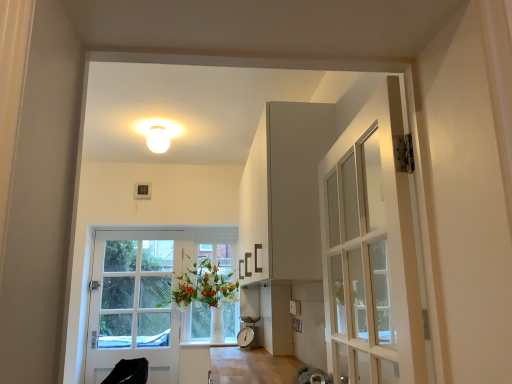
Question: Is white glossy vase at center positioned with its back to white glass vase at center?

Choices:
 (A) no
 (B) yes

Answer: (B)

Question: Would you say white glossy vase at center is a long distance from white glass vase at center?

Choices:
 (A) no
 (B) yes

Answer: (A)

Question: Can you confirm if white glossy vase at center is taller than white glass vase at center?

Choices:
 (A) yes
 (B) no

Answer: (B)

Question: Does white glossy vase at center contain white glass vase at center?

Choices:
 (A) yes
 (B) no

Answer: (B)

Question: Could you tell me if white glossy vase at center is facing white glass vase at center?

Choices:
 (A) yes
 (B) no

Answer: (A)

Question: From a real-world perspective, is white glossy vase at center physically located above or below white glass vase at center?

Choices:
 (A) below
 (B) above

Answer: (A)

Question: In terms of width, does white glossy vase at center look wider or thinner when compared to white glass vase at center?

Choices:
 (A) thin
 (B) wide

Answer: (B)

Question: Considering their positions, is white glossy vase at center located in front of or behind white glass vase at center?

Choices:
 (A) behind
 (B) front

Answer: (B)

Question: From the image's perspective, relative to white glass vase at center, is white glossy vase at center above or below?

Choices:
 (A) above
 (B) below

Answer: (B)

Question: From the image's perspective, is white matte light fixture at upper center above or below white glossy door at left?

Choices:
 (A) above
 (B) below

Answer: (A)

Question: Is white matte light fixture at upper center in front of or behind white glossy door at left in the image?

Choices:
 (A) front
 (B) behind

Answer: (A)

Question: Does point (150, 140) appear closer or farther from the camera than point (95, 334)?

Choices:
 (A) farther
 (B) closer

Answer: (B)

Question: Considering the positions of white matte light fixture at upper center and white glossy door at left in the image, is white matte light fixture at upper center taller or shorter than white glossy door at left?

Choices:
 (A) short
 (B) tall

Answer: (A)

Question: Considering the positions of white glossy vase at center and white matte light fixture at upper center in the image, is white glossy vase at center taller or shorter than white matte light fixture at upper center?

Choices:
 (A) tall
 (B) short

Answer: (A)

Question: From the image's perspective, is white glossy vase at center above or below white matte light fixture at upper center?

Choices:
 (A) below
 (B) above

Answer: (A)